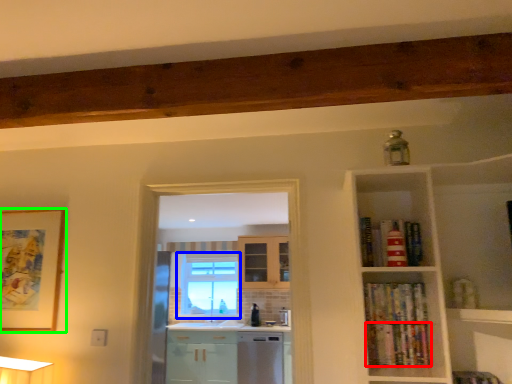
Question: Which object is positioned closest to book (highlighted by a red box)? Select from window (highlighted by a blue box) and picture frame (highlighted by a green box).

Choices:
 (A) window
 (B) picture frame

Answer: (B)